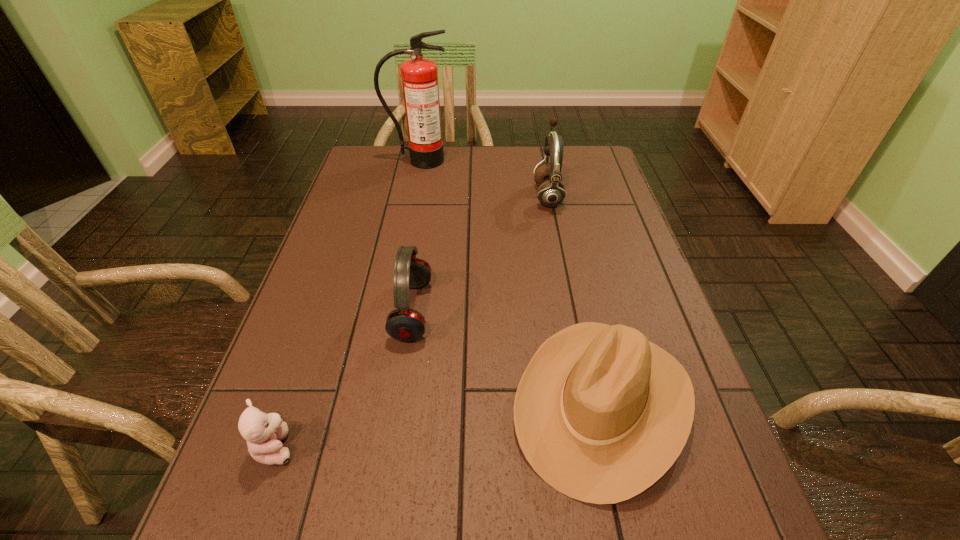
Identify the location of free space that satisfies the following two spatial constraints: 1. on the front-facing side of the fire extinguisher; 2. at the face of the leftmost object. (363, 447).

At what (x,y) coordinates should I click in order to perform the action: click on vacant area in the image that satisfies the following two spatial constraints: 1. on the back side of the fourth tallest object; 2. on the ear cups of the left earphone. Please return your answer as a coordinate pair (x, y). The height and width of the screenshot is (540, 960). Looking at the image, I should click on (582, 311).

This screenshot has width=960, height=540. I want to click on free spot that satisfies the following two spatial constraints: 1. on the ear cups of the cowboy hat; 2. on the right side of the nearer earphone, so click(x=398, y=402).

Find the location of `free location that satisfies the following two spatial constraints: 1. on the ear cups of the shorter earphone; 2. on the right side of the second shortest object`. free location that satisfies the following two spatial constraints: 1. on the ear cups of the shorter earphone; 2. on the right side of the second shortest object is located at coordinates (398, 402).

This screenshot has height=540, width=960. I want to click on vacant space that satisfies the following two spatial constraints: 1. on the front-facing side of the farthest object; 2. at the face of the leftmost object, so click(363, 447).

Locate an element on the screen. The image size is (960, 540). vacant space that satisfies the following two spatial constraints: 1. on the ear pads of the fourth nearest object; 2. on the right side of the second shortest object is located at coordinates (588, 402).